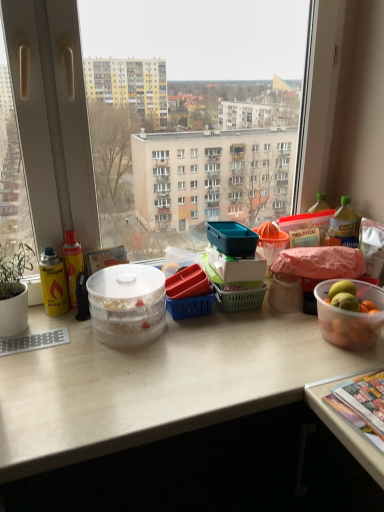
The width and height of the screenshot is (384, 512). Identify the location of free location in front of transparent glass window at center. point(170,369).